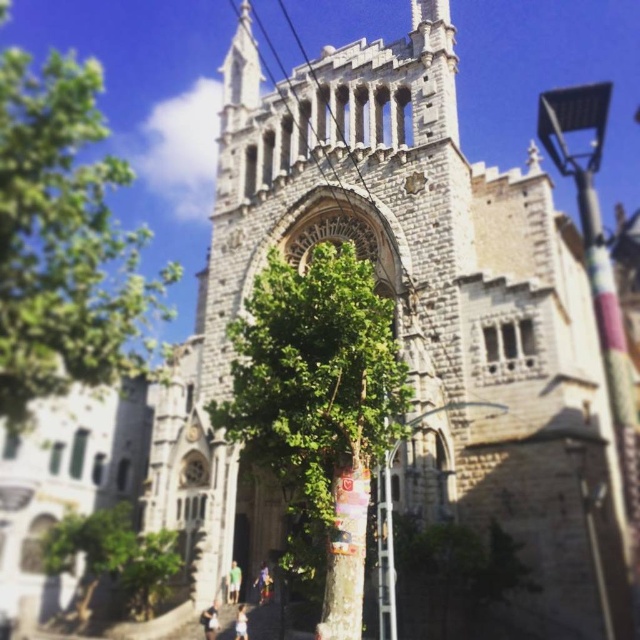
Question: Which of the following is the farthest from the observer?

Choices:
 (A) (8, 381)
 (B) (353, 579)

Answer: (A)

Question: Which of the following is the closest to the observer?

Choices:
 (A) green leafy tree at center
 (B) green leafy tree at lower left

Answer: (A)

Question: Does green leafy tree at center have a larger size compared to green leafy tree at upper left?

Choices:
 (A) yes
 (B) no

Answer: (B)

Question: Which point is farther to the camera?

Choices:
 (A) green leafy tree at upper left
 (B) green leafy tree at center

Answer: (A)

Question: In this image, where is green leafy tree at upper left located relative to green leafy tree at lower left?

Choices:
 (A) below
 (B) above

Answer: (B)

Question: From the image, what is the correct spatial relationship of green leafy tree at center in relation to green leafy tree at lower left?

Choices:
 (A) below
 (B) above

Answer: (B)